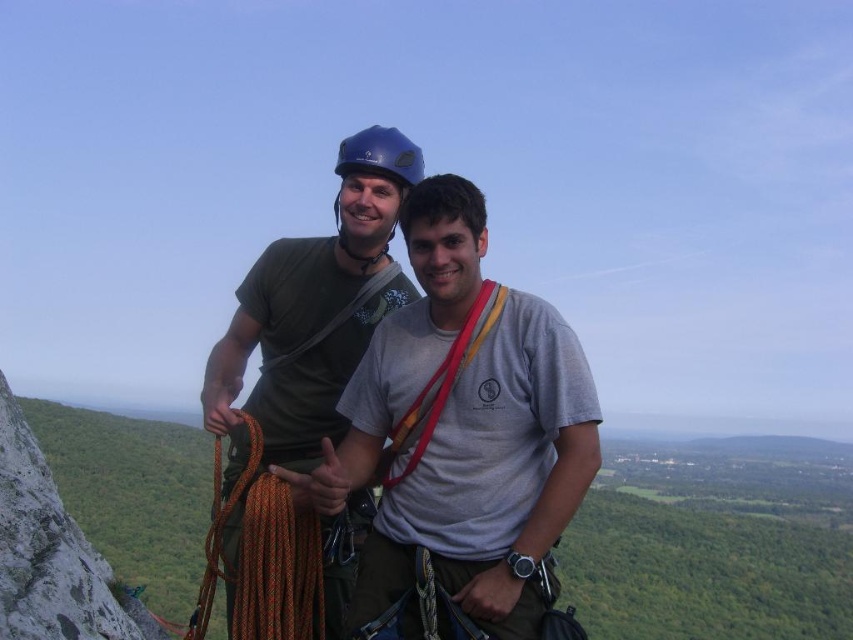
Question: Does matte green shirt at center appear over orange braided rope at center?

Choices:
 (A) yes
 (B) no

Answer: (A)

Question: Which point is farther to the camera?

Choices:
 (A) (321, 292)
 (B) (213, 451)

Answer: (B)

Question: Which point appears farthest from the camera in this image?

Choices:
 (A) (339, 541)
 (B) (258, 468)

Answer: (B)

Question: Can you confirm if matte green shirt at center is thinner than orange braided rope at center?

Choices:
 (A) no
 (B) yes

Answer: (A)

Question: Does matte green shirt at center come behind orange braided rope at center?

Choices:
 (A) no
 (B) yes

Answer: (B)